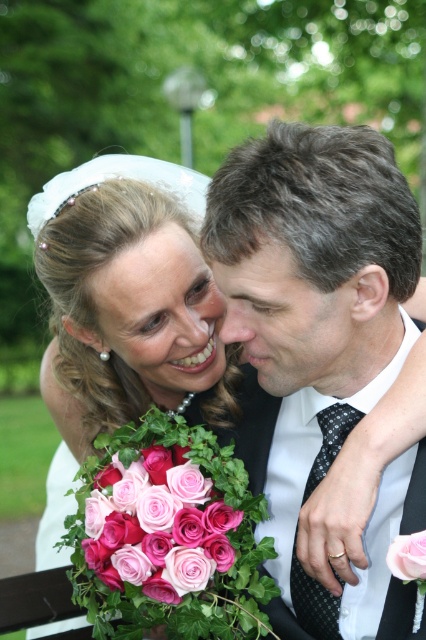
Based on the photo, does smooth skin at center appear over pink matte rose at center?

Indeed, smooth skin at center is positioned over pink matte rose at center.

Does smooth skin at center lie behind pink matte rose at center?

Yes, smooth skin at center is behind pink matte rose at center.

The width and height of the screenshot is (426, 640). Find the location of `smooth skin at center`. smooth skin at center is located at coordinates (152, 275).

In order to click on smooth skin at center in this screenshot , I will do `click(152, 275)`.

Between polished black suit at center and pink matte rose at center, which one has less height?

With less height is pink matte rose at center.

Who is taller, polished black suit at center or pink matte rose at center?

Standing taller between the two is polished black suit at center.

What do you see at coordinates (319, 328) in the screenshot?
I see `polished black suit at center` at bounding box center [319, 328].

At what (x,y) coordinates should I click in order to perform the action: click on polished black suit at center. Please return your answer as a coordinate pair (x, y). This screenshot has height=640, width=426. Looking at the image, I should click on (319, 328).

Between point (195, 483) and point (137, 252), which one is positioned in front?

Point (195, 483) is more forward.

Between pink matte roses at center and smooth skin at center, which one is positioned higher?

smooth skin at center is higher up.

Is point (169, 497) positioned after point (199, 278)?

No, it is not.

This screenshot has width=426, height=640. Identify the location of pink matte roses at center. [x=158, y=525].